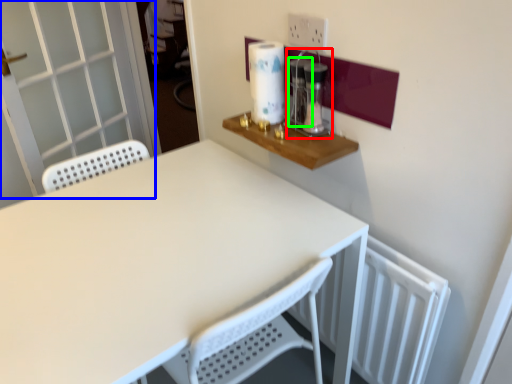
Question: Which object is positioned closest to coffee machine (highlighted by a red box)? Select from screen door (highlighted by a blue box) and appliance (highlighted by a green box).

Choices:
 (A) screen door
 (B) appliance

Answer: (B)